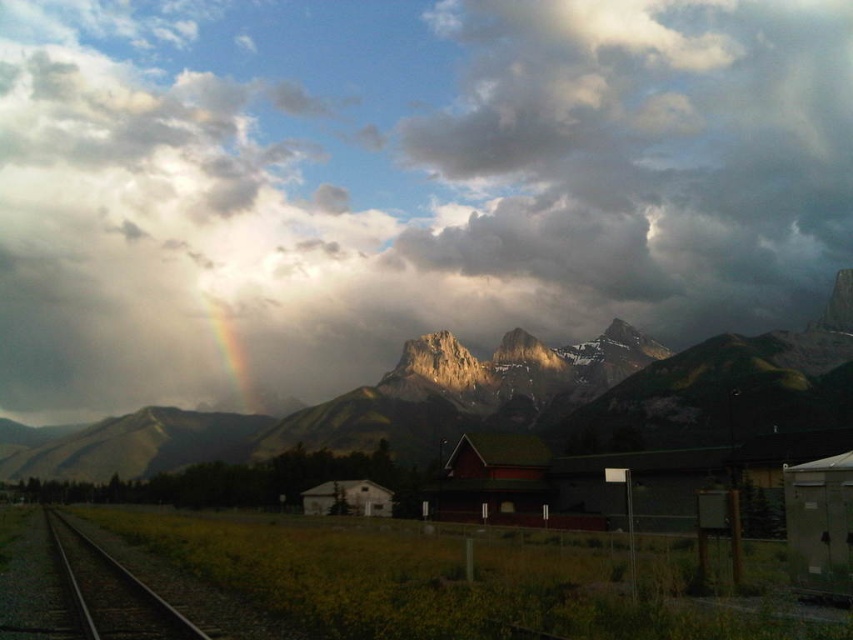
You are standing at the point closer to the camera between the two points, point (419, 58) and point (587, 403). Which point are you standing at?

You are standing at point (419, 58) because it is further to the camera than point (587, 403).

You are a photographer planning to capture the rugged granite mountains at center and the black metal train track at lower left in a single frame. Given their sizes, which object will occupy more space in your photo?

The rugged granite mountains at center will occupy more space in the photo because they are bigger than the black metal train track at lower left.

You are a photographer standing at the edge of the black metal train track at lower left, looking towards the rainbow translucent at center. Which direction should you move to get the rainbow in your shot?

You should move to the right because the rainbow translucent at center is to the left of the black metal train track at lower left, so moving right would bring the rainbow into view.